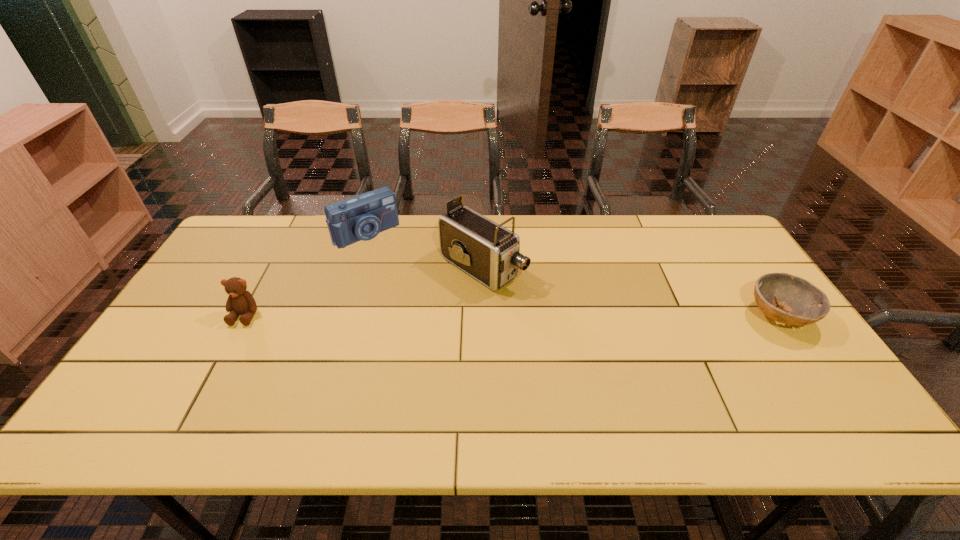
Find the location of a particular element. The height and width of the screenshot is (540, 960). free space on the desktop that is between the third tallest object and the bowl and is positioned at the lens of the tallest object is located at coordinates (559, 316).

Image resolution: width=960 pixels, height=540 pixels. In order to click on vacant space on the desktop that is between the third tallest object and the shortest object and is positioned on the lens of the second object from left to right in this screenshot , I will do `click(437, 315)`.